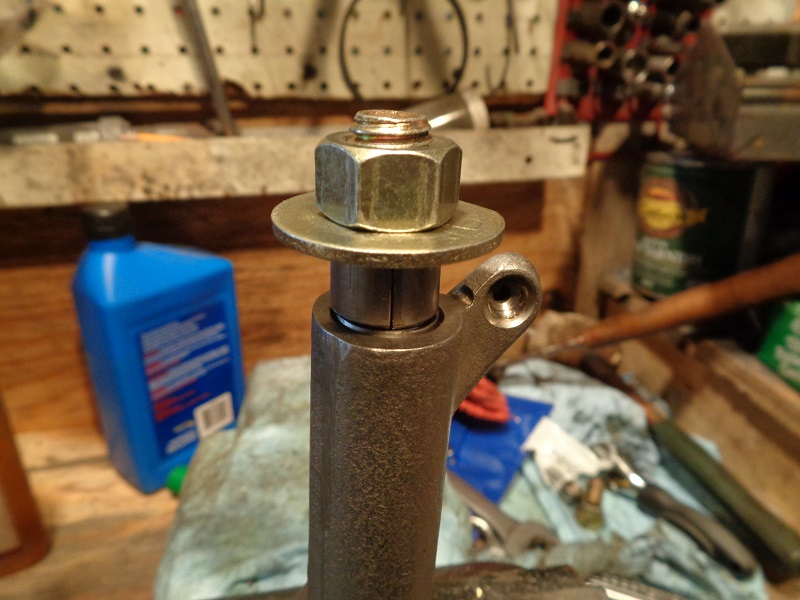
You are a GUI agent. You are given a task and a screenshot of the screen. Output one action in this format:
    pyautogui.click(x=<x>, y=<y>)
    Task: Click on the wood surface
    This screenshot has width=800, height=600.
    Given the screenshot: What is the action you would take?
    pyautogui.click(x=106, y=533)